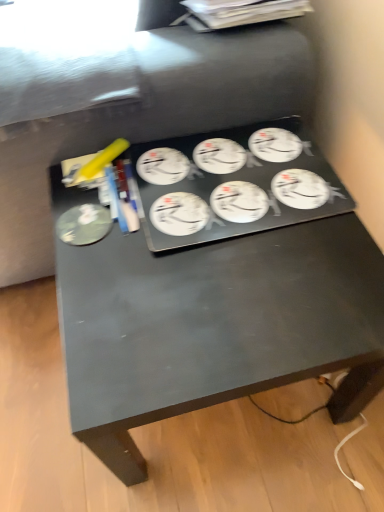
Where is `free point above black matte tray at center (from a real-world perspective)`? free point above black matte tray at center (from a real-world perspective) is located at coordinates (230, 254).